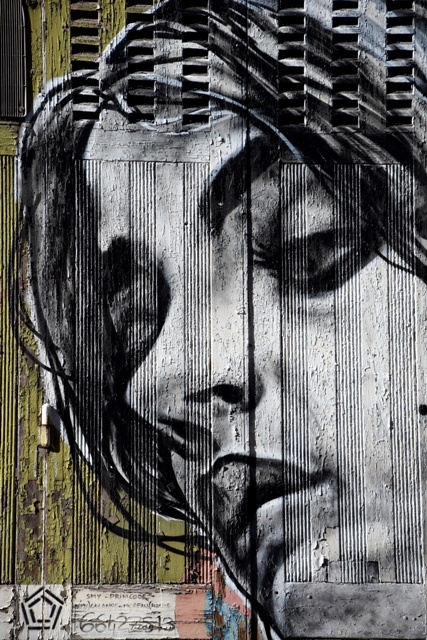
Image resolution: width=427 pixels, height=640 pixels. In order to click on window shutter in this screenshot , I will do `click(402, 54)`, `click(339, 52)`, `click(270, 50)`, `click(226, 82)`, `click(167, 68)`, `click(111, 42)`, `click(62, 54)`.